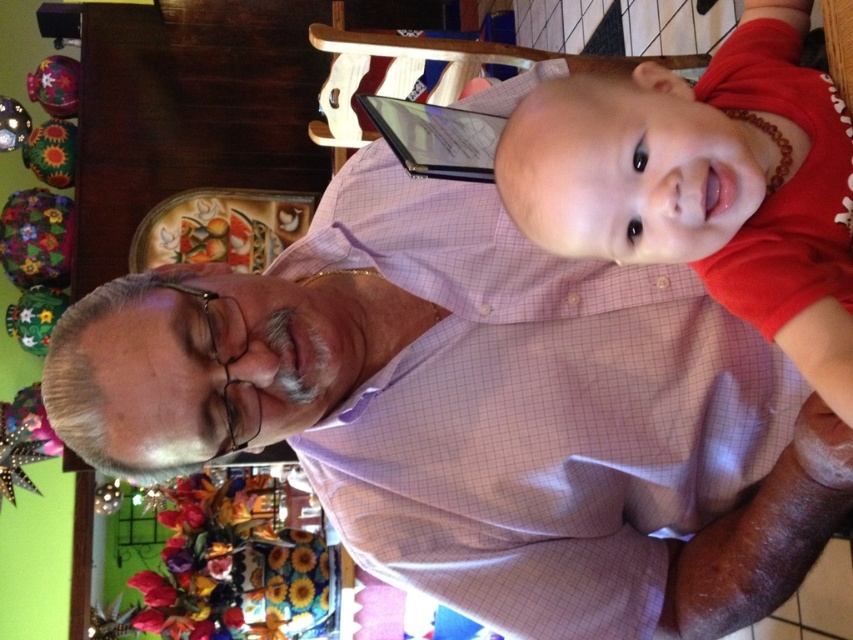
Question: Which point is closer to the camera?

Choices:
 (A) matte black tablet at upper center
 (B) red matte shirt at upper right

Answer: (B)

Question: Which point is closer to the camera taking this photo?

Choices:
 (A) (775, 266)
 (B) (457, 138)

Answer: (A)

Question: Can you confirm if red matte shirt at upper right is positioned to the left of matte black tablet at upper center?

Choices:
 (A) yes
 (B) no

Answer: (B)

Question: Among these points, which one is farthest from the camera?

Choices:
 (A) (787, 320)
 (B) (490, 131)

Answer: (B)

Question: Does red matte shirt at upper right appear on the right side of matte black tablet at upper center?

Choices:
 (A) no
 (B) yes

Answer: (B)

Question: Considering the relative positions of red matte shirt at upper right and matte black tablet at upper center in the image provided, where is red matte shirt at upper right located with respect to matte black tablet at upper center?

Choices:
 (A) right
 (B) left

Answer: (A)